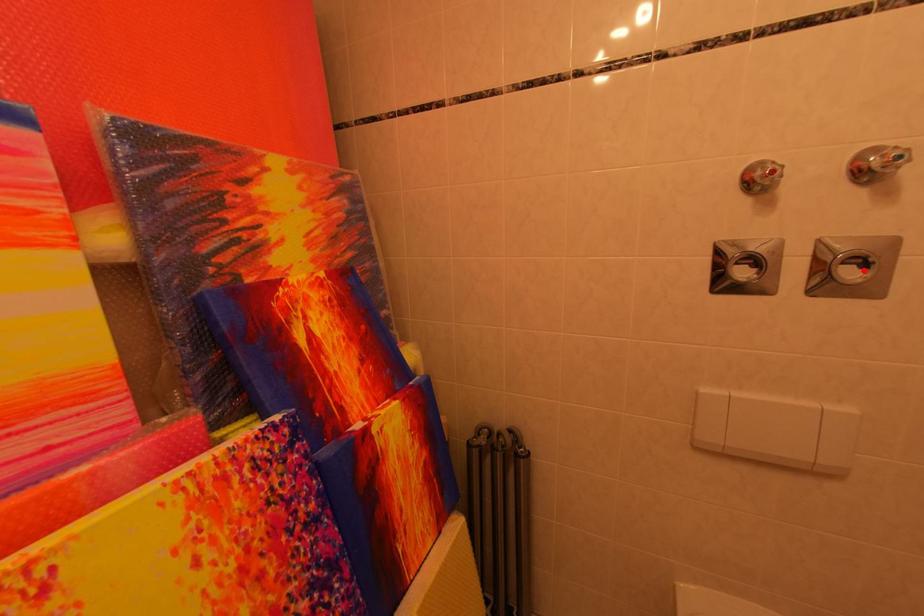
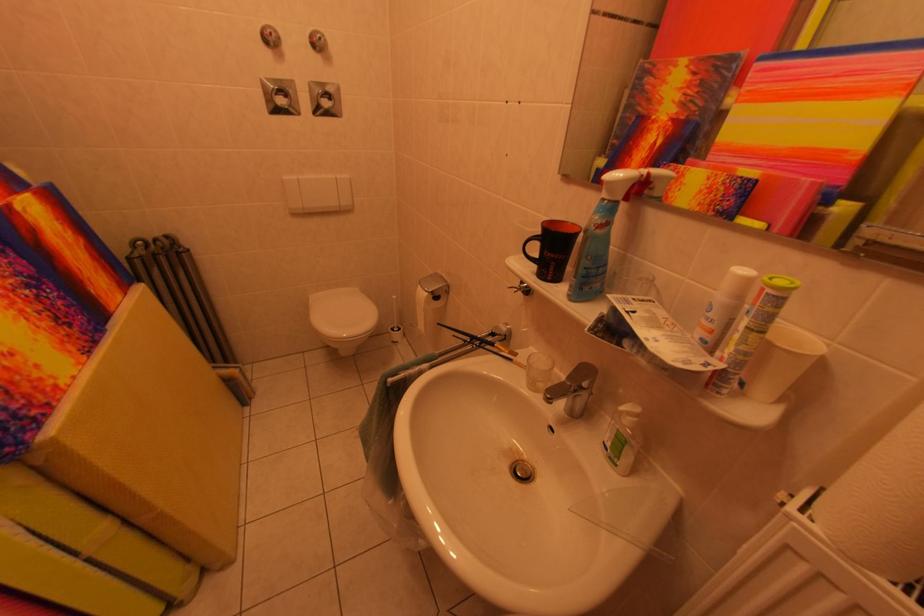
Find the pixel in the second image that matches the highlighted location in the first image.

(334, 103)